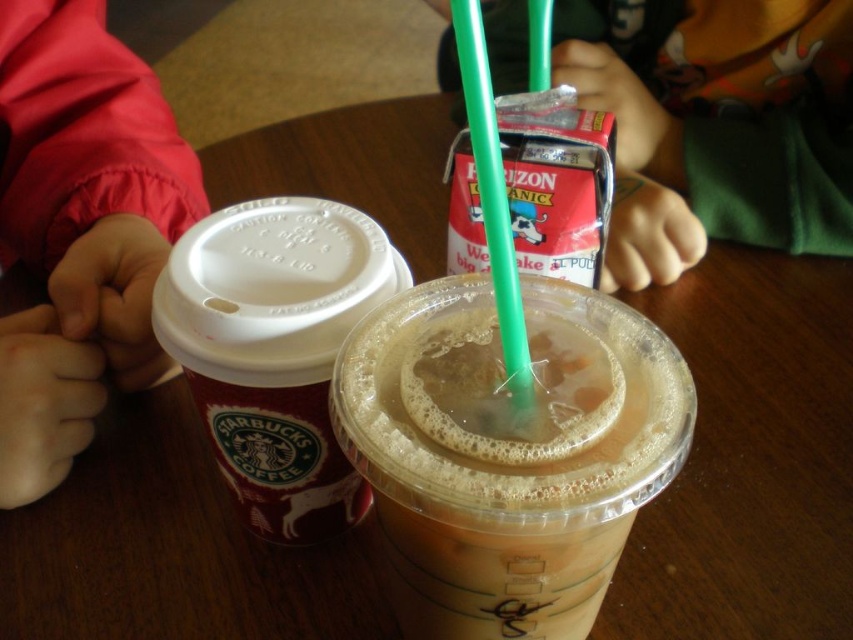
Question: Considering the real-world distances, which object is farthest from the translucent plastic cup at center?

Choices:
 (A) green plastic straw at center
 (B) green plastic straw at upper center

Answer: (B)

Question: Does translucent plastic cup at center appear under green plastic straw at upper center?

Choices:
 (A) yes
 (B) no

Answer: (A)

Question: Can you confirm if red matte starbucks coffee cup at left is positioned to the right of green plastic straw at center?

Choices:
 (A) yes
 (B) no

Answer: (B)

Question: Which of the following is the farthest from the observer?

Choices:
 (A) green plastic straw at upper center
 (B) translucent plastic cup at center

Answer: (A)

Question: Considering the relative positions of translucent plastic cup at center and green plastic straw at upper center in the image provided, where is translucent plastic cup at center located with respect to green plastic straw at upper center?

Choices:
 (A) above
 (B) below

Answer: (B)

Question: Which object appears farthest from the camera in this image?

Choices:
 (A) matte red jacket at left
 (B) green plastic straw at center
 (C) red matte starbucks coffee cup at left
 (D) translucent plastic cup at center

Answer: (A)